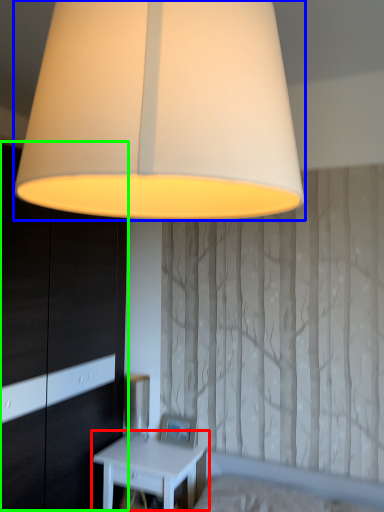
Question: Estimate the real-world distances between objects in this image. Which object is closer to nightstand (highlighted by a red box), lamp (highlighted by a blue box) or dresser (highlighted by a green box)?

Choices:
 (A) lamp
 (B) dresser

Answer: (B)